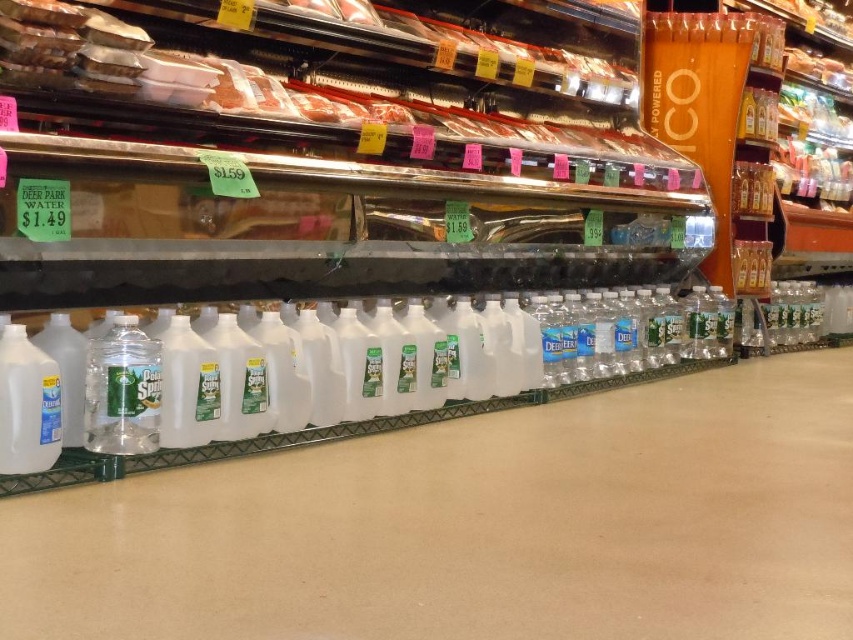
Measure the distance between clear plastic bottle at lower left and white plastic milk jug at lower left.

clear plastic bottle at lower left and white plastic milk jug at lower left are 4.87 inches apart from each other.

Find the location of `clear plastic bottle at lower left`. clear plastic bottle at lower left is located at coordinates (122, 390).